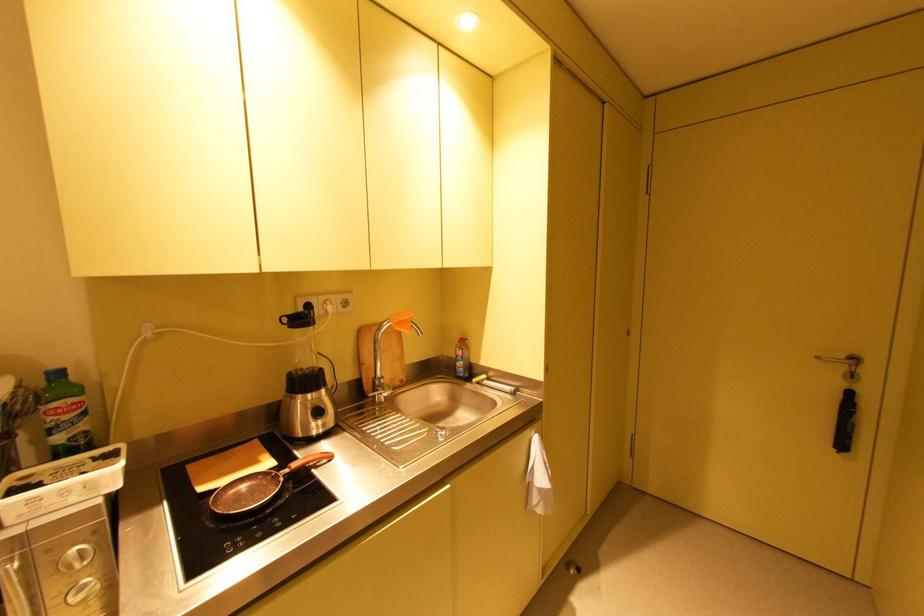
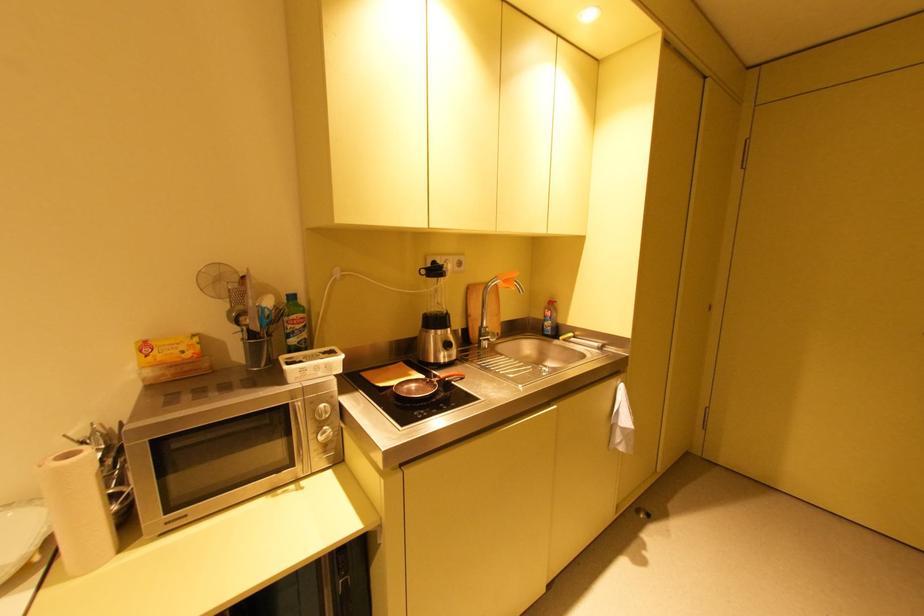
The point at (312, 395) is marked in the first image. Where is the corresponding point in the second image?

(444, 331)